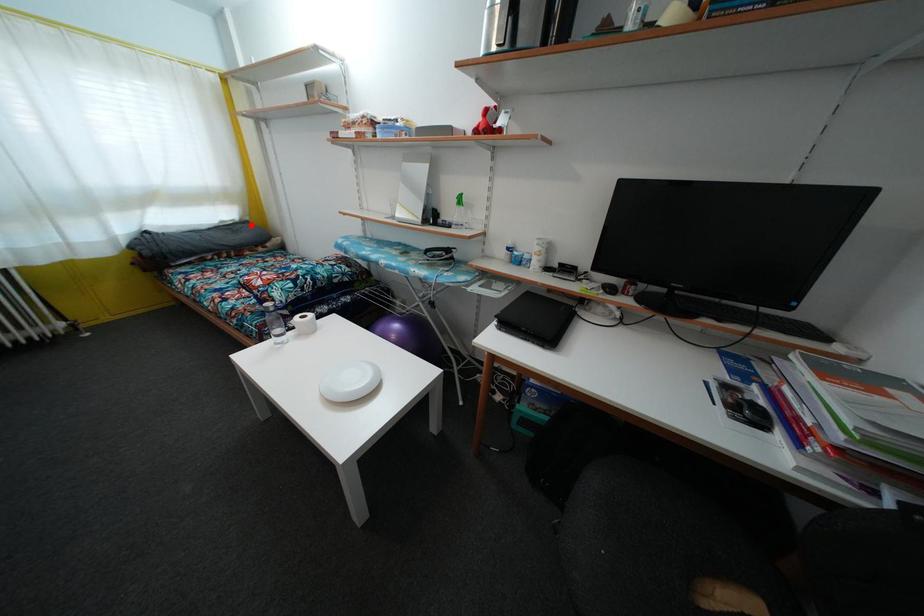
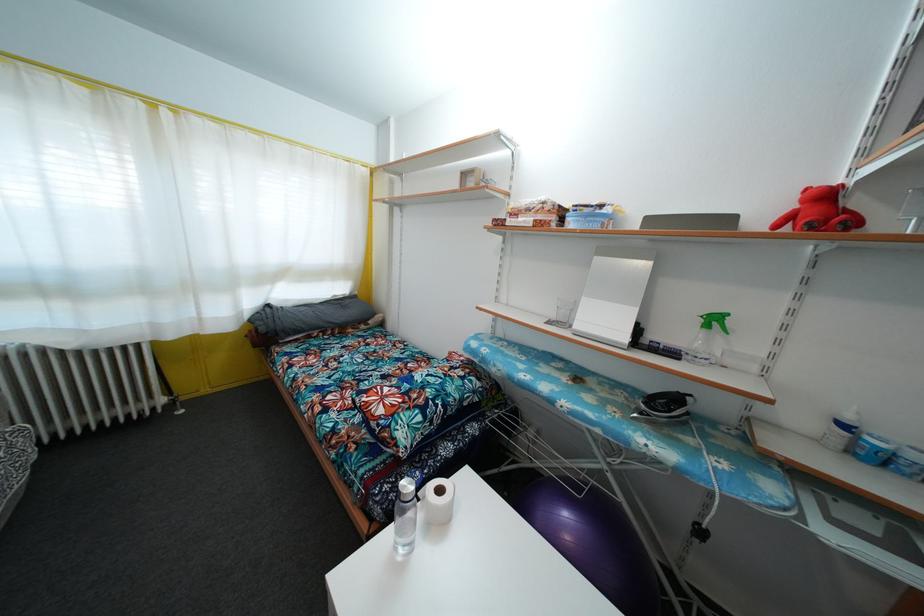
Question: I am providing you with two images of the same scene from different viewpoints. A red point is shown in image1. For the corresponding object point in image2, is it positioned nearer or farther from the camera?

Choices:
 (A) Nearer
 (B) Farther

Answer: (B)